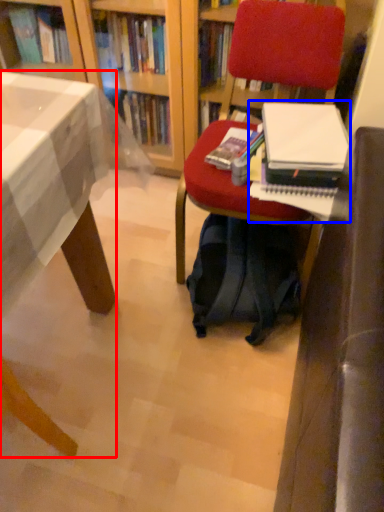
Question: Which point is further to the camera, desk (highlighted by a red box) or paperback book (highlighted by a blue box)?

Choices:
 (A) desk
 (B) paperback book

Answer: (B)